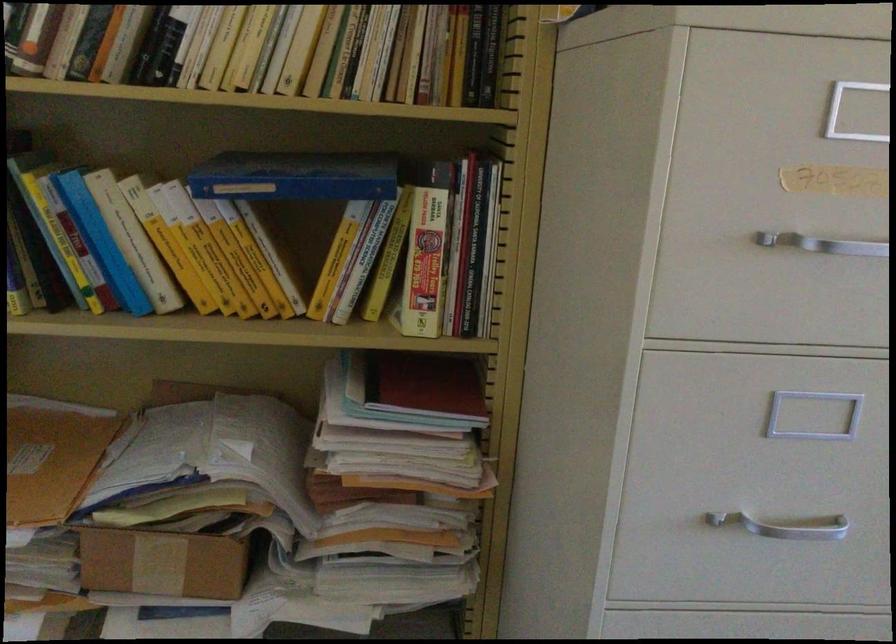
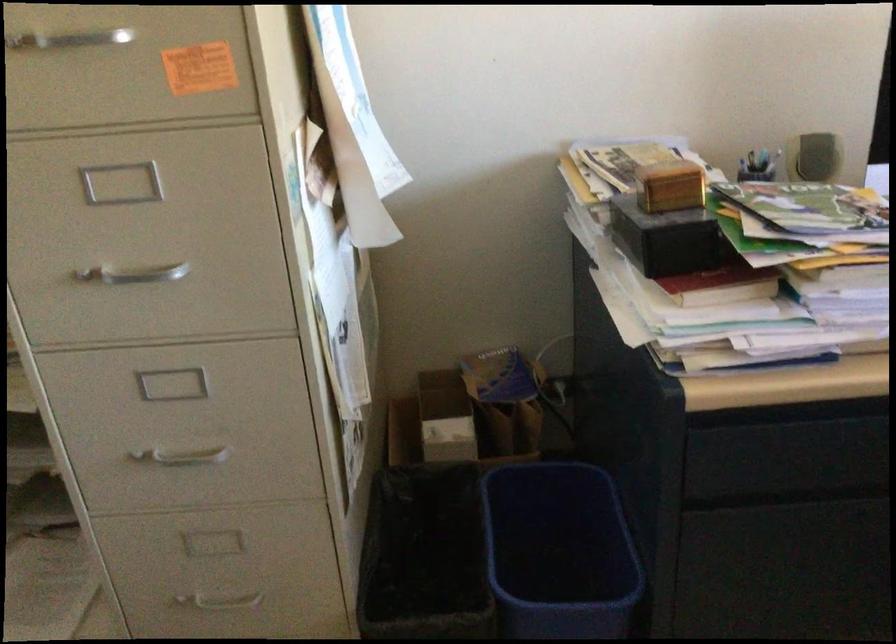
In the second image, find the point that corresponds to (x=808, y=256) in the first image.

(67, 40)